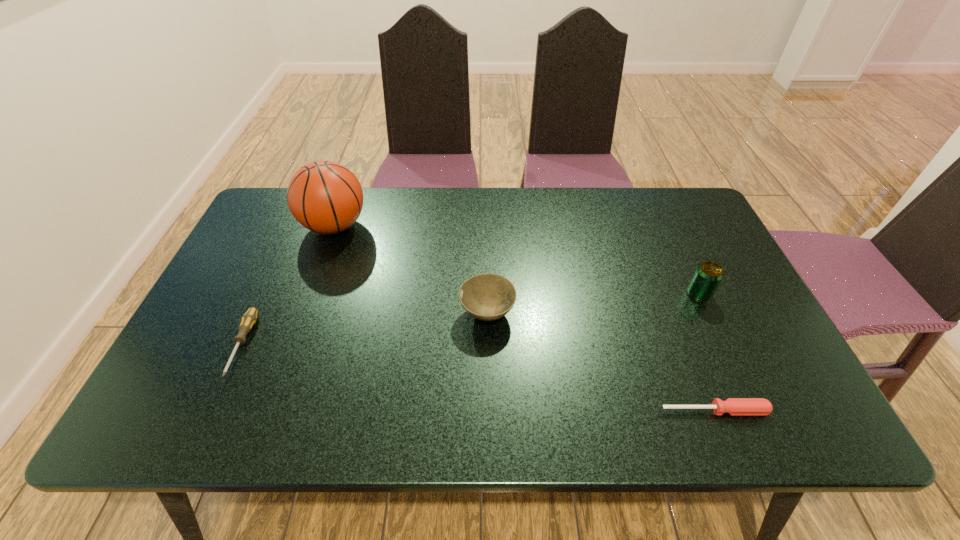
The height and width of the screenshot is (540, 960). Find the location of `vacant point located on the right of the bowl`. vacant point located on the right of the bowl is located at coordinates (571, 313).

Identify the location of vacant space situated 0.110m at the tip of the farther screwdriver. (204, 429).

Where is `blank space located on the back of the nearer screwdriver`? Image resolution: width=960 pixels, height=540 pixels. blank space located on the back of the nearer screwdriver is located at coordinates (687, 341).

Identify the location of object that is at the far edge. The image size is (960, 540). (325, 197).

Find the location of a particular element. object that is at the near edge is located at coordinates (733, 406).

You are a GUI agent. You are given a task and a screenshot of the screen. Output one action in this format:
    pyautogui.click(x=<x>, y=<y>)
    Task: Click on the basketball present at the left edge
    
    Given the screenshot: What is the action you would take?
    pyautogui.click(x=325, y=197)

The width and height of the screenshot is (960, 540). What are the coordinates of `screwdriver located in the left edge section of the desktop` in the screenshot? It's located at (249, 318).

The height and width of the screenshot is (540, 960). In order to click on beer can that is at the right edge in this screenshot , I will do `click(708, 275)`.

Where is `screwdriver located at the right edge`? This screenshot has width=960, height=540. screwdriver located at the right edge is located at coordinates click(x=733, y=406).

Locate an element on the screen. This screenshot has width=960, height=540. object positioned at the far left corner is located at coordinates (325, 197).